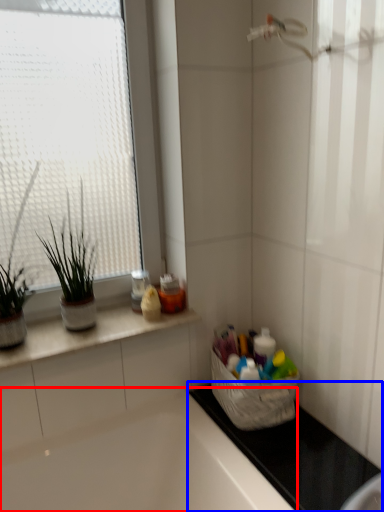
Question: Among these objects, which one is nearest to the camera, bathtub (highlighted by a red box) or counter top (highlighted by a blue box)?

Choices:
 (A) bathtub
 (B) counter top

Answer: (A)